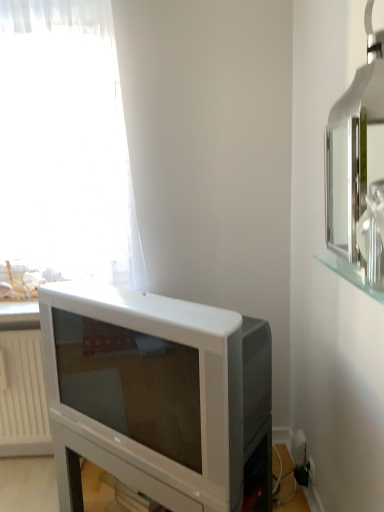
Question: Is white plastic television at lower left in contact with white plastic radiator at lower left?

Choices:
 (A) no
 (B) yes

Answer: (A)

Question: Is white plastic television at lower left turned away from white plastic radiator at lower left?

Choices:
 (A) no
 (B) yes

Answer: (A)

Question: From the image's perspective, is white plastic television at lower left on white plastic radiator at lower left?

Choices:
 (A) yes
 (B) no

Answer: (A)

Question: Does white plastic television at lower left have a lesser width compared to white plastic radiator at lower left?

Choices:
 (A) no
 (B) yes

Answer: (A)

Question: Is white plastic television at lower left completely or partially outside of white plastic radiator at lower left?

Choices:
 (A) no
 (B) yes

Answer: (B)

Question: Does white plastic television at lower left contain white plastic radiator at lower left?

Choices:
 (A) yes
 (B) no

Answer: (B)

Question: Is white plastic radiator at lower left at the left side of white plastic television at lower left?

Choices:
 (A) yes
 (B) no

Answer: (A)

Question: Considering the relative sizes of white plastic radiator at lower left and white plastic television at lower left in the image provided, is white plastic radiator at lower left shorter than white plastic television at lower left?

Choices:
 (A) yes
 (B) no

Answer: (B)

Question: Can you see white plastic radiator at lower left touching white plastic television at lower left?

Choices:
 (A) yes
 (B) no

Answer: (B)

Question: Does white plastic radiator at lower left have a lesser width compared to white plastic television at lower left?

Choices:
 (A) no
 (B) yes

Answer: (B)

Question: Considering the relative sizes of white plastic radiator at lower left and white plastic television at lower left in the image provided, is white plastic radiator at lower left smaller than white plastic television at lower left?

Choices:
 (A) no
 (B) yes

Answer: (B)

Question: Does white plastic radiator at lower left lie in front of white plastic television at lower left?

Choices:
 (A) yes
 (B) no

Answer: (B)

Question: From a real-world perspective, is silver metallic medicine cabinet at upper right located higher than white plastic radiator at lower left?

Choices:
 (A) no
 (B) yes

Answer: (B)